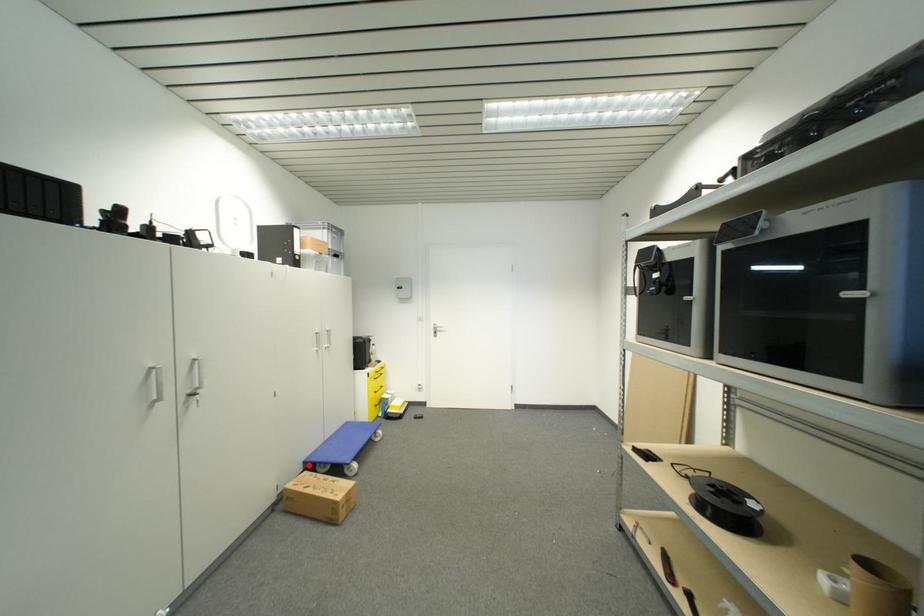
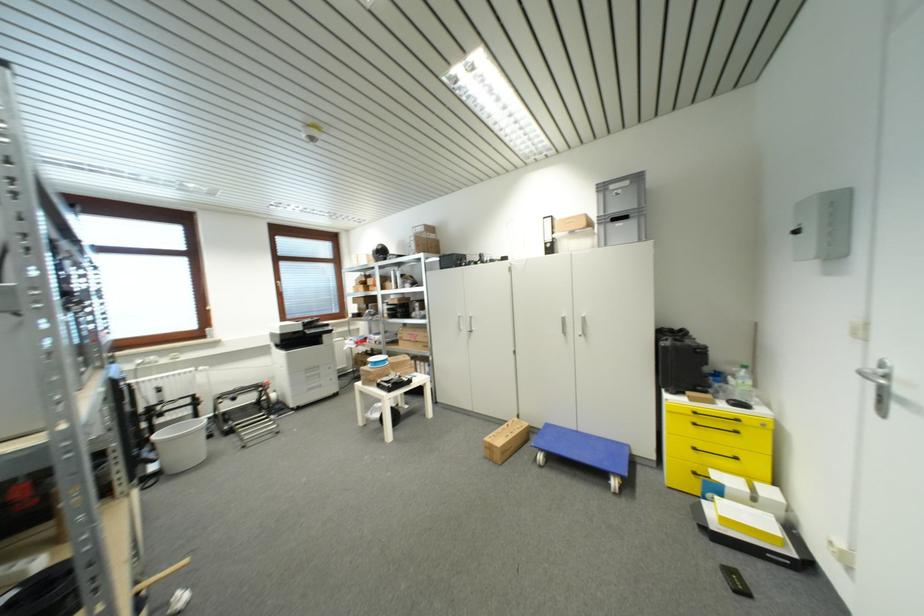
Where in the second image is the point corresponding to the highlighted location from the first image?

(552, 427)